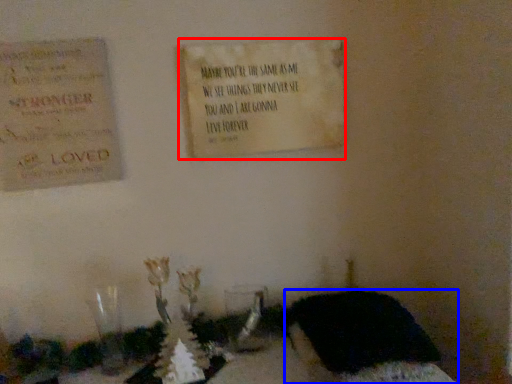
Question: Which point is further to the camera, notice (highlighted by a red box) or furniture (highlighted by a blue box)?

Choices:
 (A) notice
 (B) furniture

Answer: (A)